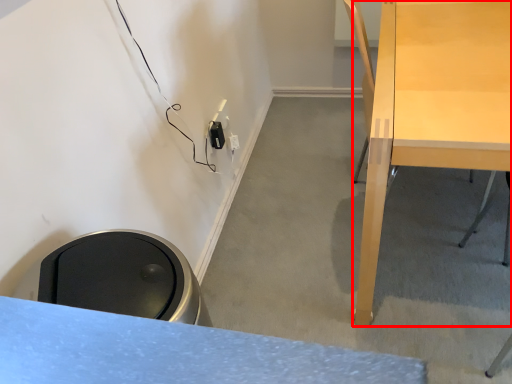
Question: From the image, what is the correct spatial relationship of desk (annotated by the red box) in relation to electric outlet?

Choices:
 (A) left
 (B) right

Answer: (B)